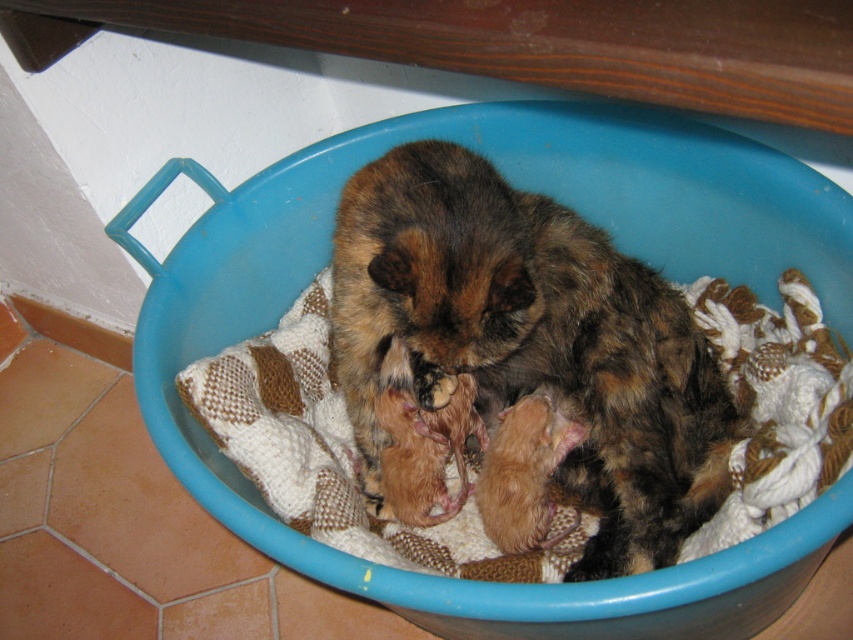
You are a pet owner who wants to place a small toy mouse next to the blue plastic bowl at center and the fluffy brown cat at center. Based on their sizes, which object can the toy mouse fit next to without overlapping?

The blue plastic bowl at center has a larger width than the fluffy brown cat at center, so the toy mouse can fit next to the blue plastic bowl at center without overlapping.

You are a pet owner who wants to place a small toy mouse inside the blue plastic bowl at center so that the fluffy brown cat at center can reach it easily. Based on the height of the bowl compared to the cat, would the cat be able to comfortably reach the toy without difficulty?

The blue plastic bowl at center is much taller than the fluffy brown cat at center. Since the bowl is significantly taller, the cat would have difficulty reaching the toy mouse placed inside it comfortably.